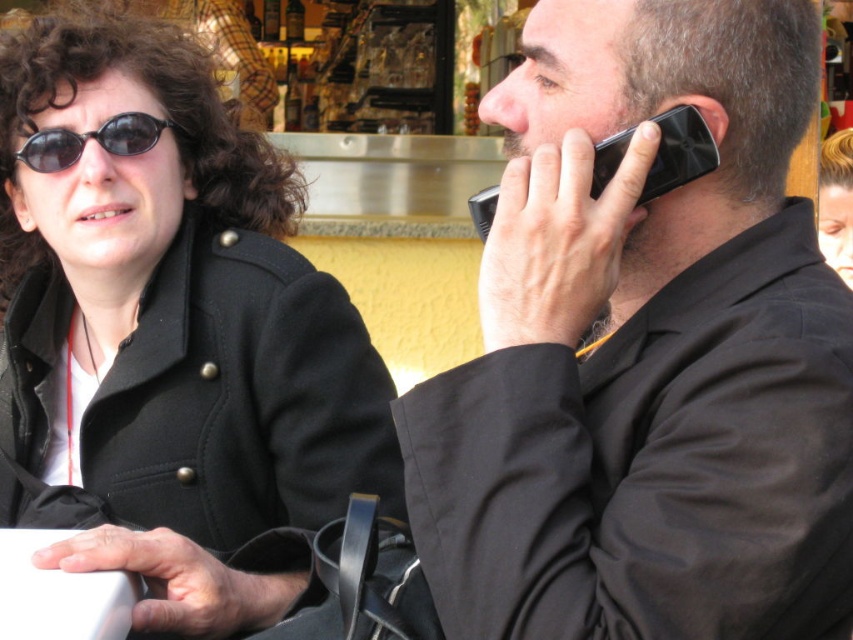
Question: Estimate the real-world distances between objects in this image. Which object is farther from the black plastic phone at right?

Choices:
 (A) black matte phone at right
 (B) black wool coat at upper left

Answer: (B)

Question: Is black plastic phone at right positioned behind black plastic sunglasses at upper left?

Choices:
 (A) no
 (B) yes

Answer: (A)

Question: Among these points, which one is farthest from the camera?

Choices:
 (A) (113, 86)
 (B) (703, 564)
 (C) (672, 140)
 (D) (38, 168)

Answer: (A)

Question: Which of the following is the closest to the observer?

Choices:
 (A) (540, 467)
 (B) (666, 125)

Answer: (A)

Question: Can you confirm if black matte phone at right is thinner than black plastic sunglasses at upper left?

Choices:
 (A) no
 (B) yes

Answer: (A)

Question: Is black matte phone at right bigger than black plastic sunglasses at upper left?

Choices:
 (A) no
 (B) yes

Answer: (B)